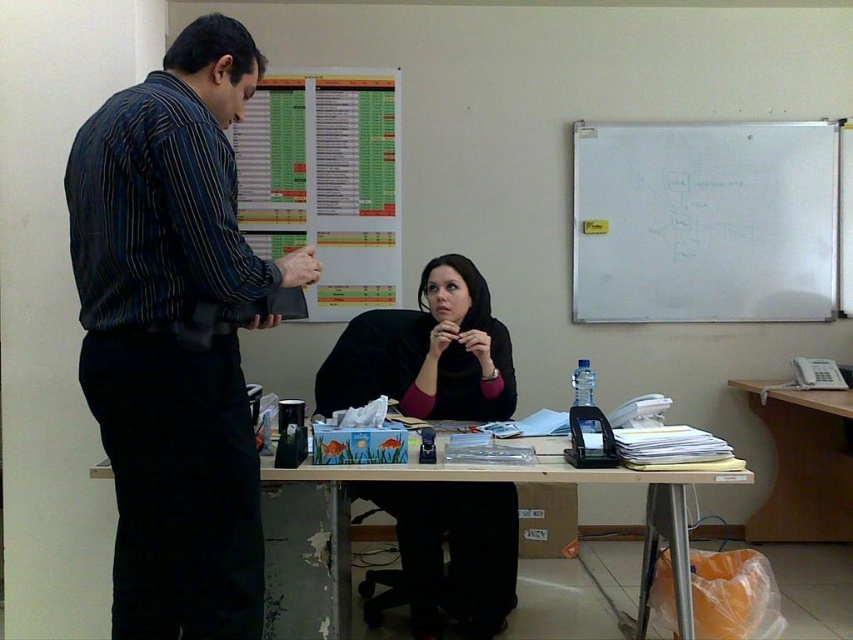
Question: Does striped fabric shirt at left have a lesser width compared to wooden desk at lower right?

Choices:
 (A) no
 (B) yes

Answer: (B)

Question: Is striped fabric shirt at left to the right of black matte hijab at center from the viewer's perspective?

Choices:
 (A) no
 (B) yes

Answer: (A)

Question: Among these points, which one is nearest to the camera?

Choices:
 (A) (490, 576)
 (B) (776, 385)

Answer: (A)

Question: Which object is positioned closest to the black matte hijab at center?

Choices:
 (A) wooden table at center
 (B) striped fabric shirt at left
 (C) white matte whiteboard at upper right

Answer: (A)

Question: Can you confirm if striped fabric shirt at left is bigger than wooden desk at lower right?

Choices:
 (A) yes
 (B) no

Answer: (B)

Question: Estimate the real-world distances between objects in this image. Which object is closer to the wooden table at center?

Choices:
 (A) wooden desk at lower right
 (B) black matte hijab at center
 (C) white matte whiteboard at upper right

Answer: (B)